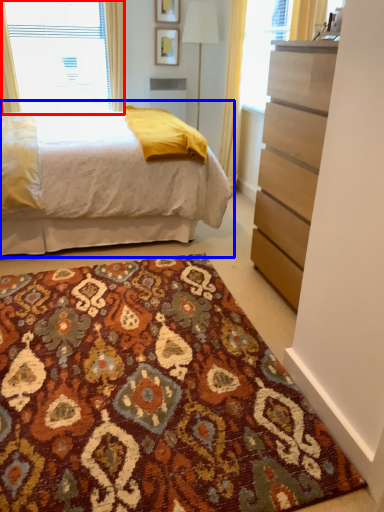
Question: Among these objects, which one is farthest to the camera, window (highlighted by a red box) or bed (highlighted by a blue box)?

Choices:
 (A) window
 (B) bed

Answer: (A)